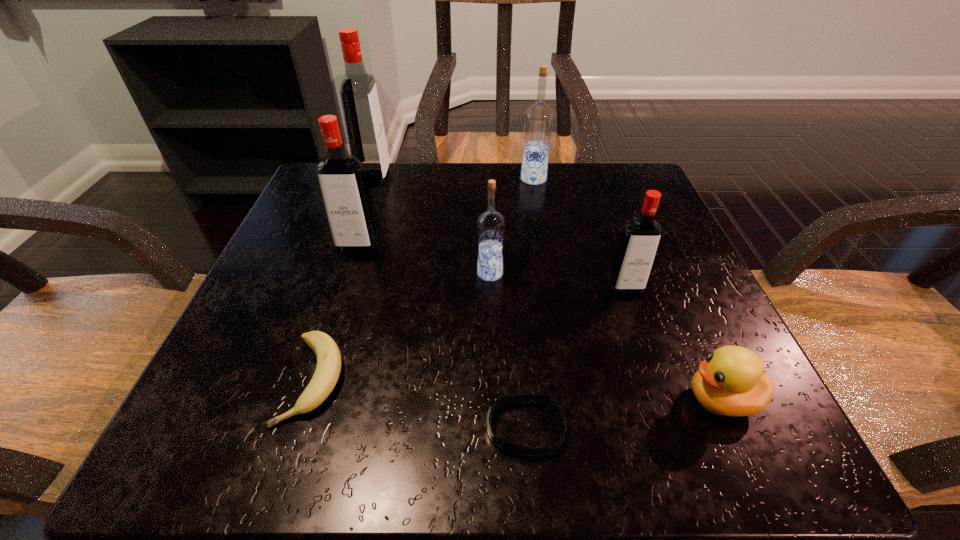
Image resolution: width=960 pixels, height=540 pixels. Find the location of `the farthest red vodka`. the farthest red vodka is located at coordinates (363, 119).

Identify the location of the tallest object. (363, 119).

The width and height of the screenshot is (960, 540). I want to click on the bigger blue vodka, so click(538, 119).

Locate an element on the screen. the farther blue vodka is located at coordinates (538, 119).

In order to click on the third nearest vodka in this screenshot , I will do click(341, 179).

You are a GUI agent. You are given a task and a screenshot of the screen. Output one action in this format:
    pyautogui.click(x=<x>, y=<y>)
    Task: Click on the second smallest red vodka
    
    Given the screenshot: What is the action you would take?
    pyautogui.click(x=341, y=179)

You are a GUI agent. You are given a task and a screenshot of the screen. Output one action in this format:
    pyautogui.click(x=<x>, y=<y>)
    Task: Click on the rightmost red vodka
    
    Given the screenshot: What is the action you would take?
    pyautogui.click(x=640, y=238)

Where is `the nearest red vodka`? The width and height of the screenshot is (960, 540). the nearest red vodka is located at coordinates [x=640, y=238].

Where is `the nearer blue vodka`? The image size is (960, 540). the nearer blue vodka is located at coordinates (491, 224).

This screenshot has width=960, height=540. In order to click on the third vodka from right to left in this screenshot , I will do coord(491,224).